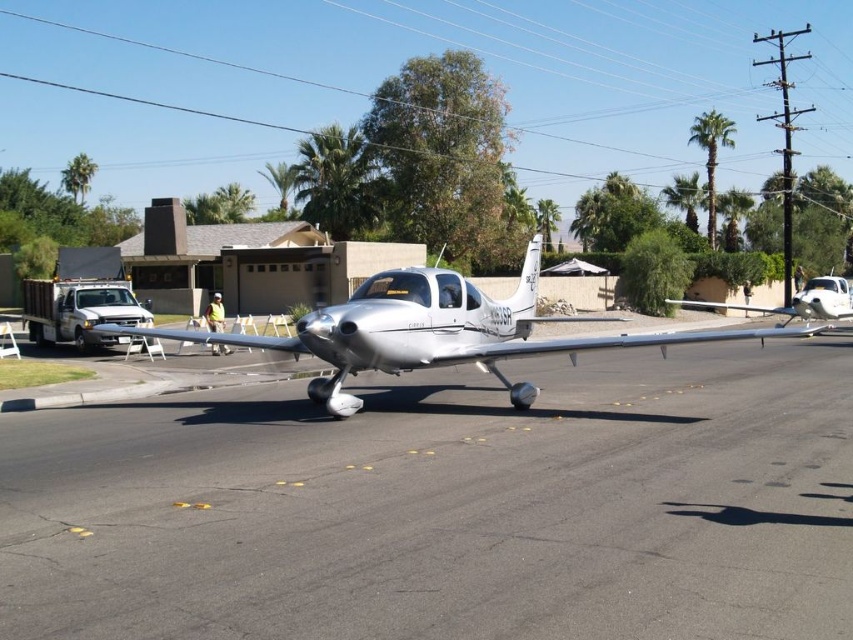
Between silver metallic airplane at center and silver metallic airplane at right, which one is positioned higher?

silver metallic airplane at right

Can you confirm if silver metallic airplane at center is positioned to the right of silver metallic airplane at right?

No, silver metallic airplane at center is not to the right of silver metallic airplane at right.

You are a GUI agent. You are given a task and a screenshot of the screen. Output one action in this format:
    pyautogui.click(x=<x>, y=<y>)
    Task: Click on the silver metallic airplane at center
    This screenshot has height=640, width=853.
    Given the screenshot: What is the action you would take?
    pyautogui.click(x=436, y=330)

Does smooth asphalt tarmac at center appear on the right side of silver metallic airplane at center?

Incorrect, smooth asphalt tarmac at center is not on the right side of silver metallic airplane at center.

Does smooth asphalt tarmac at center come in front of silver metallic airplane at center?

Yes.

Is point (183, 525) positioned after point (405, 346)?

No, it is not.

The image size is (853, 640). What are the coordinates of `smooth asphalt tarmac at center` in the screenshot? It's located at (447, 506).

Is smooth asphalt tarmac at center bigger than silver metallic airplane at right?

No, smooth asphalt tarmac at center is not bigger than silver metallic airplane at right.

Based on the photo, is smooth asphalt tarmac at center behind silver metallic airplane at right?

No.

Between point (86, 481) and point (851, 289), which one is positioned behind?

Positioned behind is point (851, 289).

Identify the location of smooth asphalt tarmac at center. This screenshot has width=853, height=640. (447, 506).